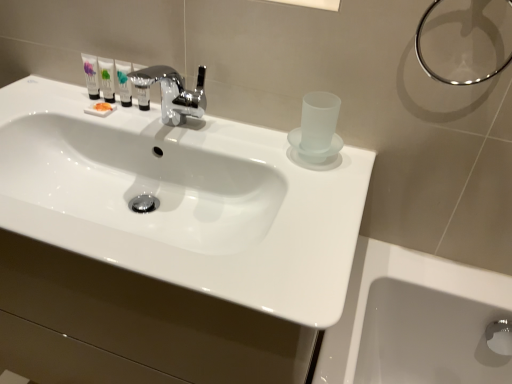
You are a GUI agent. You are given a task and a screenshot of the screen. Output one action in this format:
    pyautogui.click(x=<x>, y=<y>)
    Task: Click on the vacant area that is situated to the right of matte white tube at upper left, the fourth mouthwash viewed from the right
    This screenshot has height=384, width=512.
    Given the screenshot: What is the action you would take?
    pyautogui.click(x=167, y=125)